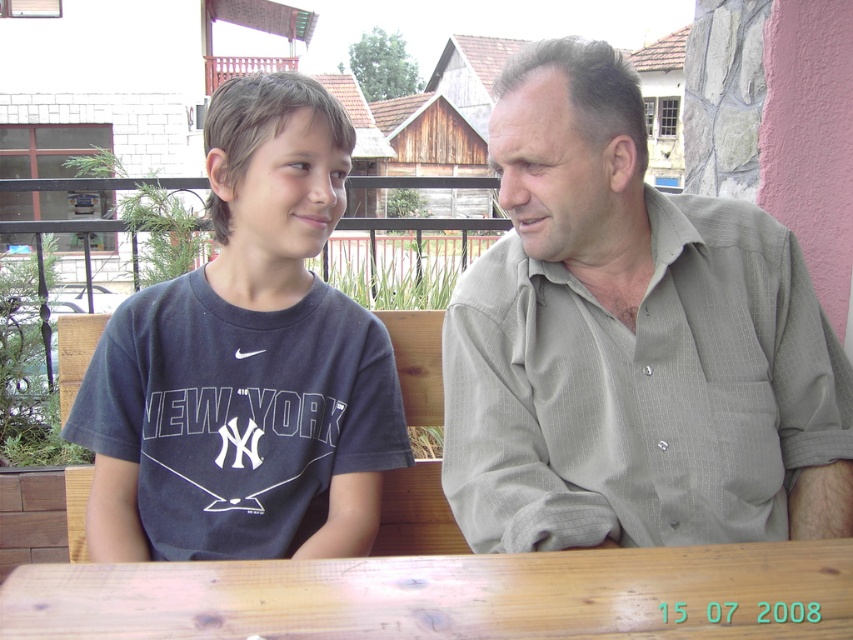
Can you confirm if dark blue t-shirt at left is thinner than wooden table at center?

Indeed, dark blue t-shirt at left has a lesser width compared to wooden table at center.

Which is behind, point (323, 179) or point (553, 589)?

The point (323, 179) is behind.

In the scene shown: Who is more forward, (135, 532) or (723, 580)?

Positioned in front is point (723, 580).

Find the location of a particular element. dark blue t-shirt at left is located at coordinates (245, 362).

Who is taller, gray textured shirt at upper right or wooden table at center?

With more height is gray textured shirt at upper right.

Describe the element at coordinates (631, 342) in the screenshot. I see `gray textured shirt at upper right` at that location.

What do you see at coordinates (631, 342) in the screenshot? I see `gray textured shirt at upper right` at bounding box center [631, 342].

In order to click on gray textured shirt at upper right in this screenshot , I will do `click(631, 342)`.

Looking at this image, is gray textured shirt at upper right smaller than dark blue t-shirt at left?

Incorrect, gray textured shirt at upper right is not smaller in size than dark blue t-shirt at left.

Is gray textured shirt at upper right bigger than dark blue t-shirt at left?

Correct, gray textured shirt at upper right is larger in size than dark blue t-shirt at left.

Which is behind, point (515, 195) or point (263, 259)?

Point (263, 259)

Find the location of a particular element. The image size is (853, 640). gray textured shirt at upper right is located at coordinates (631, 342).